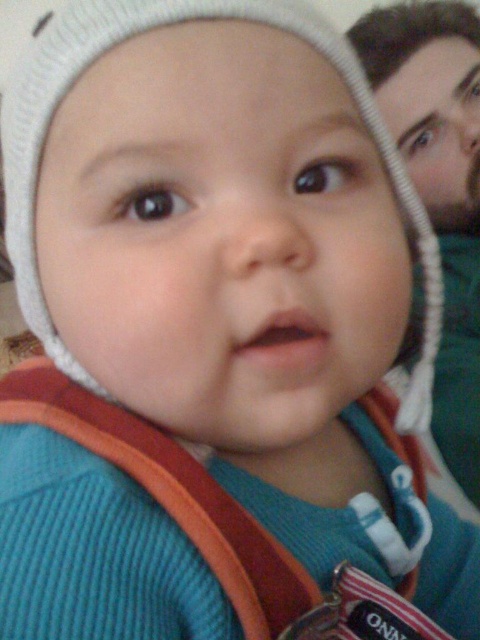
How distant is bearded man at right from bearded man at upper right?

bearded man at right is 1.00 inches away from bearded man at upper right.

This screenshot has width=480, height=640. Identify the location of bearded man at right. (440, 186).